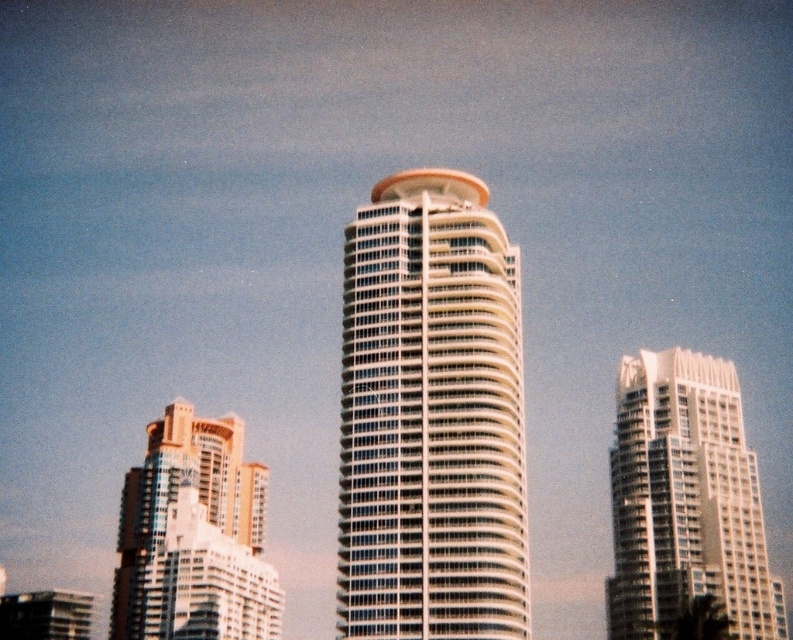
How far apart are white glass building at right and matte glass building at lower left?

white glass building at right and matte glass building at lower left are 242.58 feet apart.

Is point (753, 492) closer to viewer compared to point (0, 628)?

Yes, it is in front of point (0, 628).

The height and width of the screenshot is (640, 793). What are the coordinates of `white glass building at right` in the screenshot? It's located at (684, 499).

Is gold metallic building at left shorter than matte glass building at lower left?

Yes.

Which is more to the left, gold metallic building at left or matte glass building at lower left?

Positioned to the left is matte glass building at lower left.

Image resolution: width=793 pixels, height=640 pixels. I want to click on gold metallic building at left, so click(193, 536).

How much distance is there between white glass building at center and matte glass building at lower left?

white glass building at center and matte glass building at lower left are 77.86 meters apart from each other.

Who is more forward, (x=454, y=531) or (x=75, y=608)?

Point (x=454, y=531)

The height and width of the screenshot is (640, 793). Describe the element at coordinates (431, 417) in the screenshot. I see `white glass building at center` at that location.

Where is `white glass building at center`? This screenshot has width=793, height=640. white glass building at center is located at coordinates (431, 417).